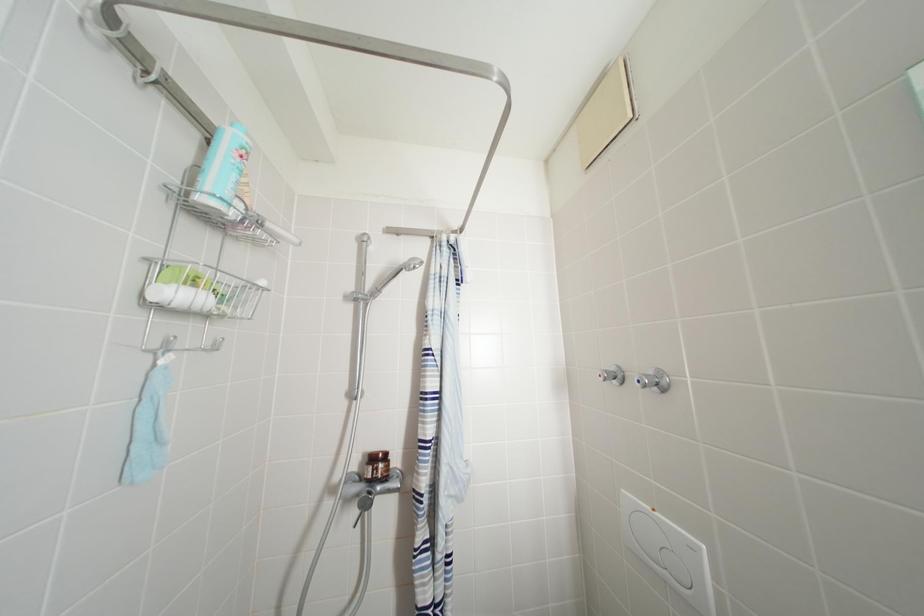
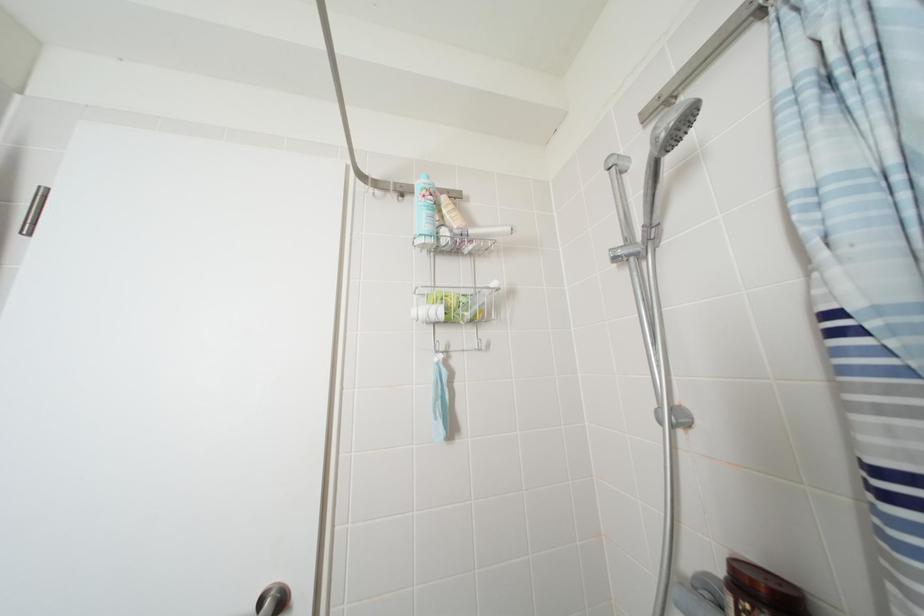
Question: The camera is either moving clockwise (left) or counter-clockwise (right) around the object. The first image is from the beginning of the video and the second image is from the end. Is the camera moving left or right when shooting the video?

Choices:
 (A) Left
 (B) Right

Answer: (B)